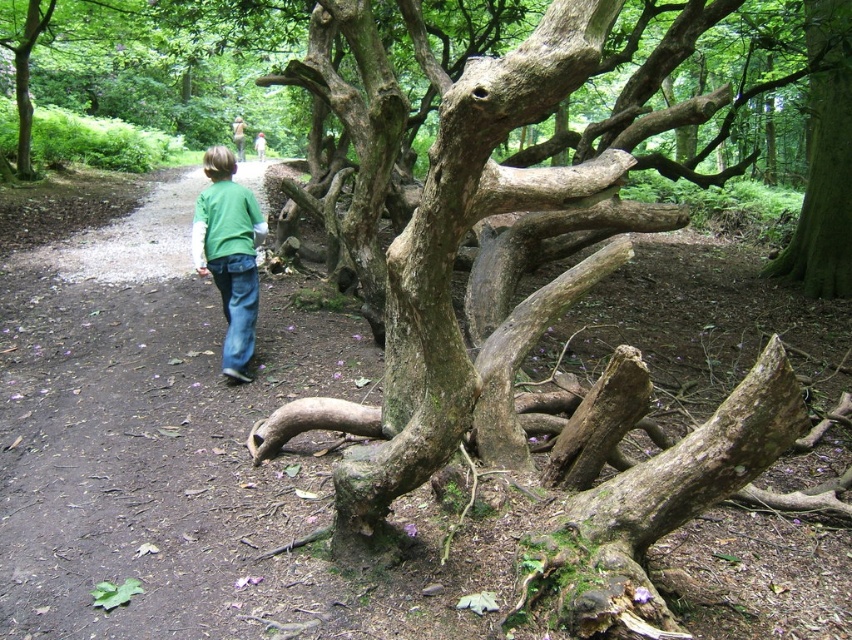
Question: Does green rough bark tree at upper right have a smaller size compared to green matte shirt at center?

Choices:
 (A) no
 (B) yes

Answer: (A)

Question: Among these objects, which one is farthest from the camera?

Choices:
 (A) green matte shirt at center
 (B) green rough bark tree at upper right

Answer: (B)

Question: Can you confirm if green rough bark tree at upper right is wider than blue denim jeans at center?

Choices:
 (A) yes
 (B) no

Answer: (A)

Question: Based on their relative distances, which object is nearer to the green rough bark tree at upper right?

Choices:
 (A) blue denim jeans at center
 (B) green matte shirt at center

Answer: (A)

Question: Can you confirm if green matte shirt at center is positioned below blue denim jeans at center?

Choices:
 (A) no
 (B) yes

Answer: (A)

Question: Among these points, which one is farthest from the camera?

Choices:
 (A) (793, 266)
 (B) (239, 330)
 (C) (246, 312)

Answer: (A)